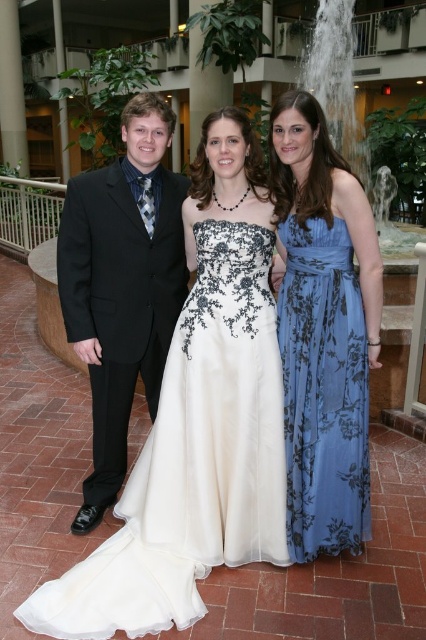
Does blue floral dress at center have a greater width compared to black satin suit at center?

Incorrect, blue floral dress at center's width does not surpass black satin suit at center's.

This screenshot has width=426, height=640. What do you see at coordinates (324, 330) in the screenshot? I see `blue floral dress at center` at bounding box center [324, 330].

At what (x,y) coordinates should I click in order to perform the action: click on blue floral dress at center. Please return your answer as a coordinate pair (x, y). Looking at the image, I should click on (324, 330).

Is point (210, 404) farther from viewer compared to point (330, 502)?

No, it is not.

What do you see at coordinates (192, 460) in the screenshot? The width and height of the screenshot is (426, 640). I see `ivory satin dress at center` at bounding box center [192, 460].

Locate an element on the screen. The image size is (426, 640). ivory satin dress at center is located at coordinates (192, 460).

Does point (77, 621) lie in front of point (115, 188)?

Yes.

Find the location of a particular element. The width and height of the screenshot is (426, 640). ivory satin dress at center is located at coordinates (192, 460).